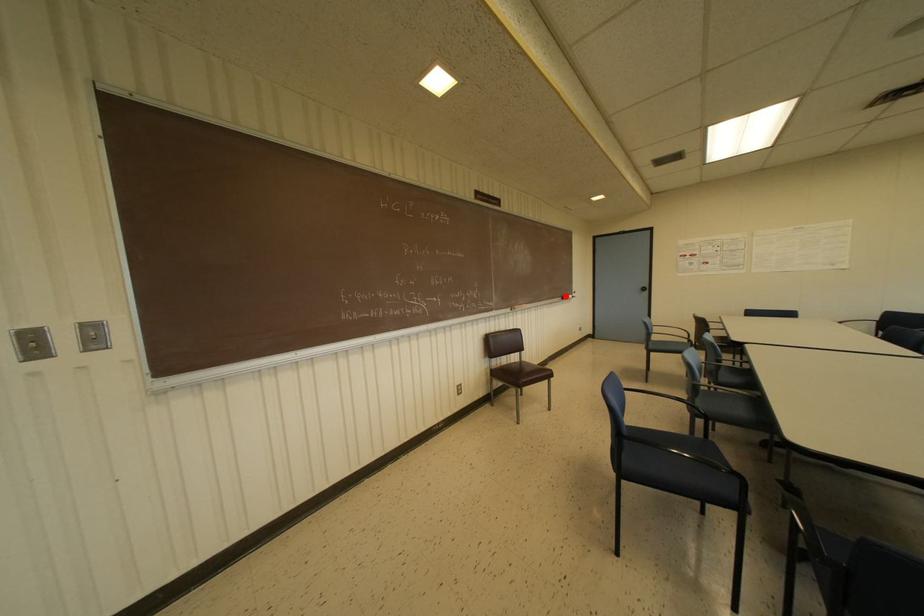
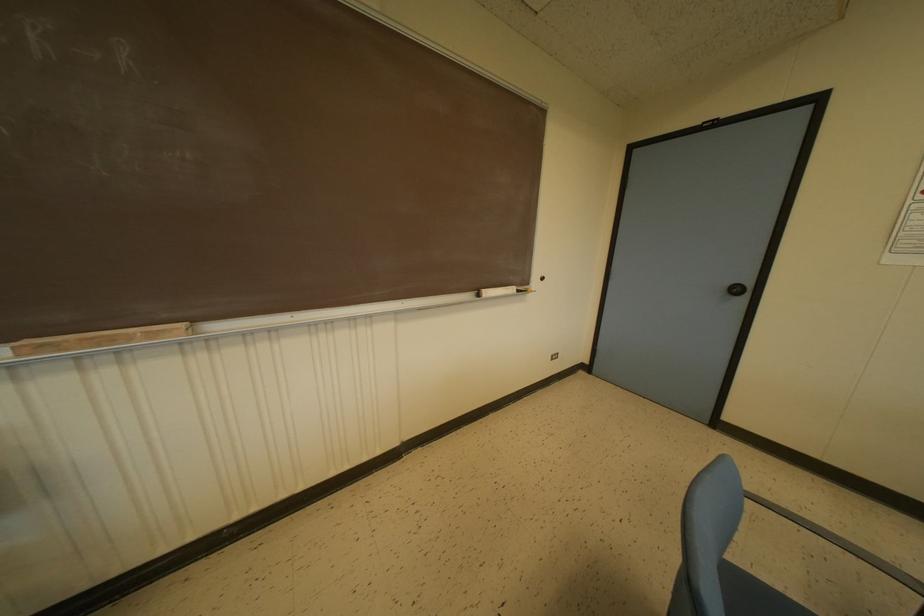
Question: I am providing you with two images of the same scene from different viewpoints. A red point is marked on the first image. Is the red point's position out of view in image 2?

Choices:
 (A) Yes
 (B) No

Answer: (B)